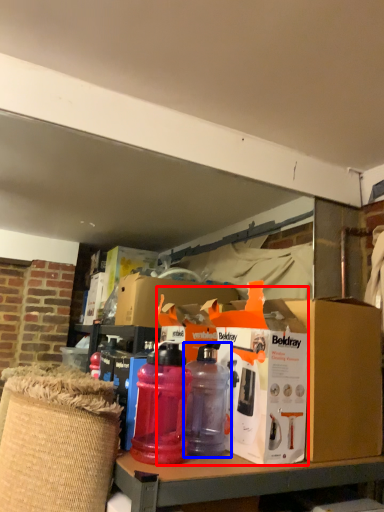
Question: Among these objects, which one is nearest to the camera, box (highlighted by a red box) or bottle (highlighted by a blue box)?

Choices:
 (A) box
 (B) bottle

Answer: (A)